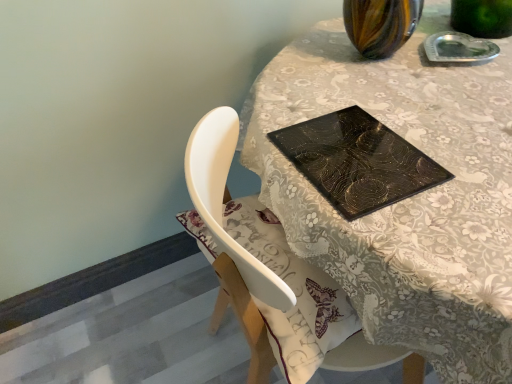
Question: From the image's perspective, is black glossy placemat at upper center located above or below matte black glass table at center?

Choices:
 (A) above
 (B) below

Answer: (A)

Question: In the image, is black glossy placemat at upper center on the left side or the right side of matte black glass table at center?

Choices:
 (A) right
 (B) left

Answer: (B)

Question: In terms of size, does black glossy placemat at upper center appear bigger or smaller than matte black glass table at center?

Choices:
 (A) big
 (B) small

Answer: (B)

Question: In the image, is matte black glass table at center on the left side or the right side of black glossy placemat at upper center?

Choices:
 (A) right
 (B) left

Answer: (A)

Question: From the image's perspective, is matte black glass table at center positioned above or below black glossy placemat at upper center?

Choices:
 (A) below
 (B) above

Answer: (A)

Question: Based on their sizes in the image, would you say matte black glass table at center is bigger or smaller than black glossy placemat at upper center?

Choices:
 (A) small
 (B) big

Answer: (B)

Question: Considering the positions of matte black glass table at center and black glossy placemat at upper center in the image, is matte black glass table at center wider or thinner than black glossy placemat at upper center?

Choices:
 (A) wide
 (B) thin

Answer: (A)